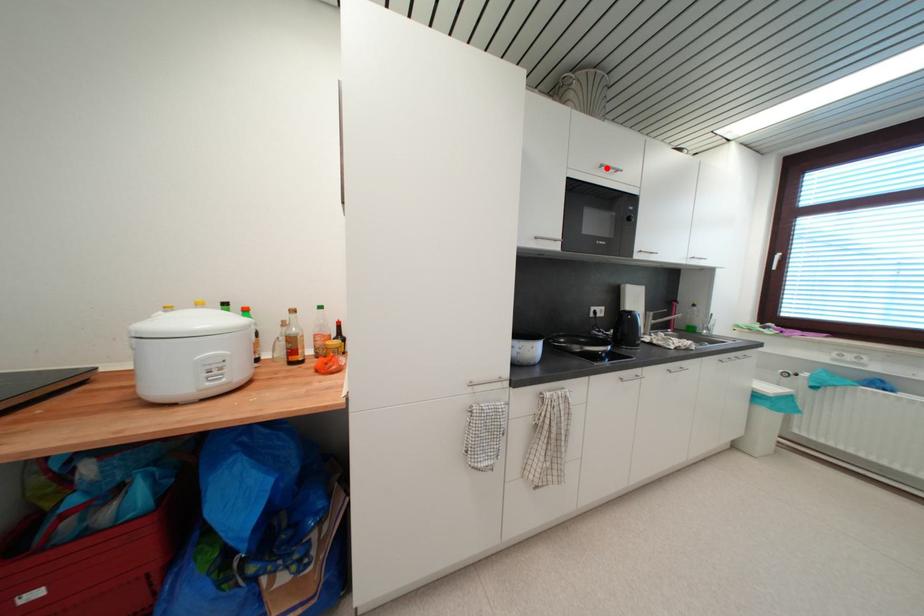
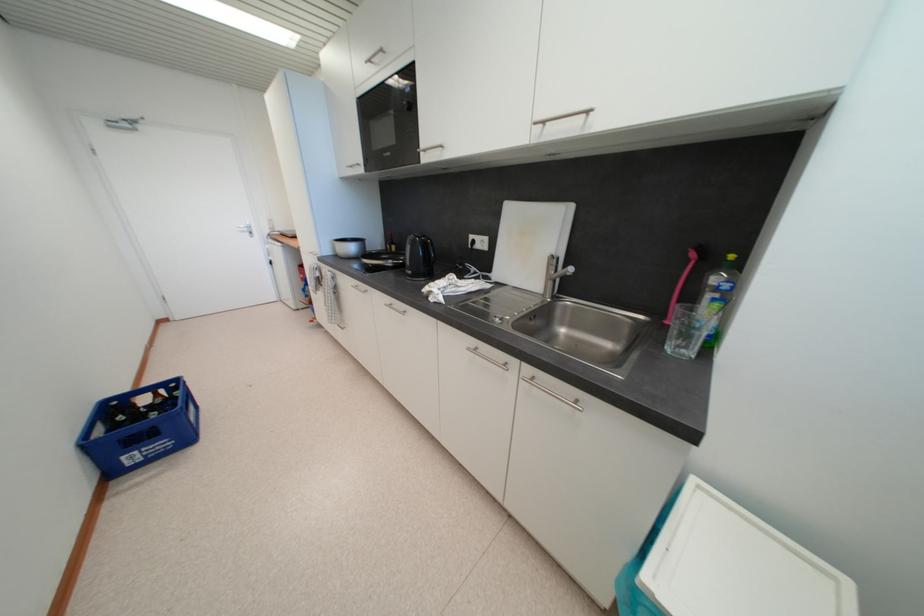
Locate, in the second image, the point that corresponds to the highlighted location in the first image.

(375, 63)